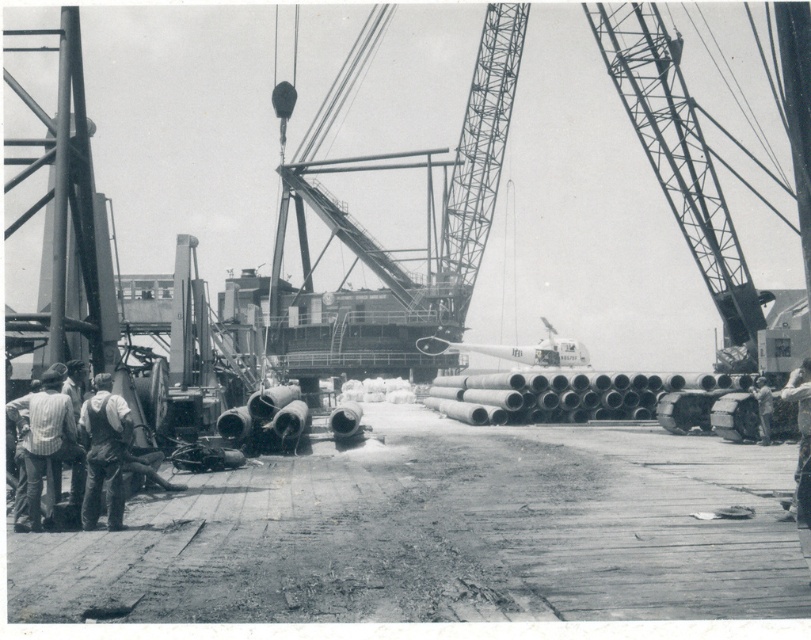
Find the location of `striped shirt at left`. striped shirt at left is located at coordinates (49, 442).

Who is taller, striped shirt at left or light gray fabric shirt at lower right?

striped shirt at left

Is point (59, 454) behind point (762, 442)?

No.

Locate an element on the screen. The image size is (811, 640). striped shirt at left is located at coordinates coord(49,442).

Is metallic gray crane at right thinner than light gray fabric shirt at lower right?

In fact, metallic gray crane at right might be wider than light gray fabric shirt at lower right.

Is point (730, 284) farther from camera compared to point (766, 404)?

Yes, it is behind point (766, 404).

Where is `metallic gray crane at right`? metallic gray crane at right is located at coordinates (678, 156).

Can you confirm if metallic gray crane at center is taller than denim overalls at lower left?

Yes.

Between point (483, 189) and point (109, 435), which one is positioned in front?

Point (109, 435) is more forward.

Where is `metallic gray crane at center`? Image resolution: width=811 pixels, height=640 pixels. metallic gray crane at center is located at coordinates (398, 248).